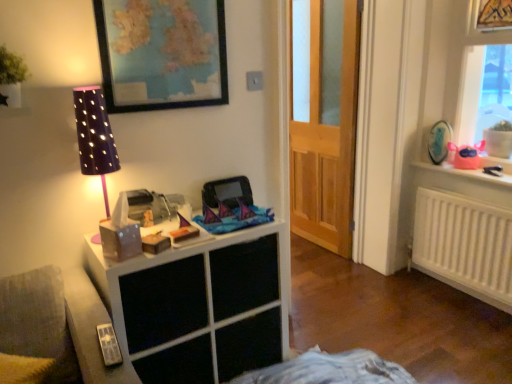
Question: Does point click(x=164, y=21) appear closer or farther from the camera than point click(x=94, y=94)?

Choices:
 (A) closer
 (B) farther

Answer: (B)

Question: Considering the positions of wooden framed map at upper center, the 2th picture frame positioned from the bottom, and purple dotted fabric at left in the image, is wooden framed map at upper center, the 2th picture frame positioned from the bottom, taller or shorter than purple dotted fabric at left?

Choices:
 (A) tall
 (B) short

Answer: (B)

Question: Which object is positioned farthest from the white matte radiator at right?

Choices:
 (A) matte blue picture frame at upper right, arranged as the first picture frame when viewed from the back
 (B) pink plastic toy at upper right
 (C) purple dotted fabric at left
 (D) gold metallic picture frame at upper right, acting as the 3th picture frame starting from the bottom
 (E) pink plastic bag at upper right

Answer: (C)

Question: Which is farther from the pink plastic toy at upper right?

Choices:
 (A) white matte cabinet at left
 (B) purple dotted fabric at left
 (C) pink plastic bag at upper right
 (D) pink plastic toy at upper right
 (E) gold metallic picture frame at upper right, the third picture frame in the left-to-right sequence

Answer: (B)